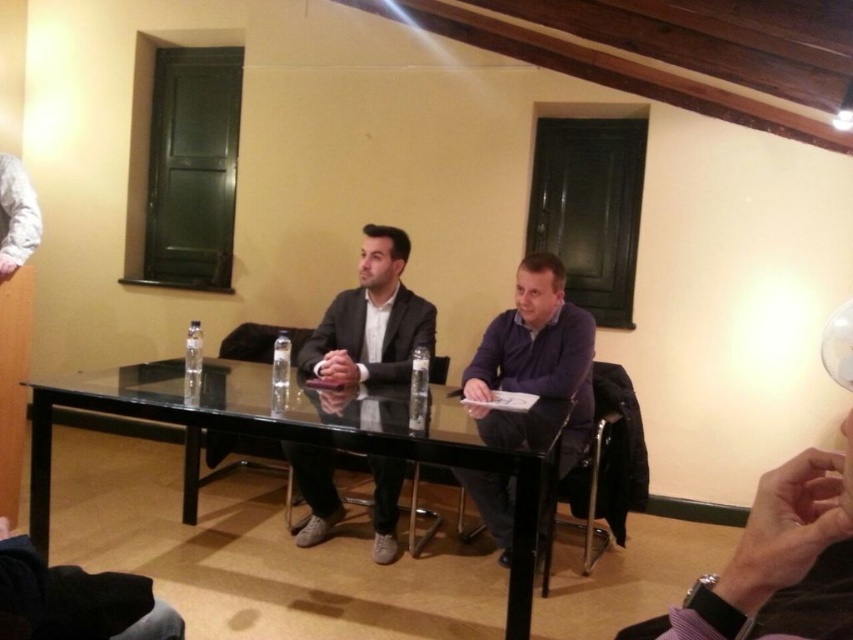
You are organizing a meeting in this room and need to place a large presentation board on the table. Considering the transparent glass table at center and the purple matte shirt at center, which object is more suitable for placing the board?

The transparent glass table at center has a larger size compared to the purple matte shirt at center, so it is more suitable for placing the large presentation board.

You are standing in the room and want to place a large decorative vase on the transparent glass table at center. Based on the coordinates provided, can you confirm if the table is positioned in the center of the room?

The transparent glass table at center is located at coordinates point (322, 436), which typically corresponds to the central area of the room. Therefore, the table is positioned in the center of the room.

You are standing in the room and want to walk towards both points marked on the table. Which point, point (384, 266) or point (486, 381), will you reach first?

Point (384, 266) is closer to you than point (486, 381), so you will reach point (384, 266) first.